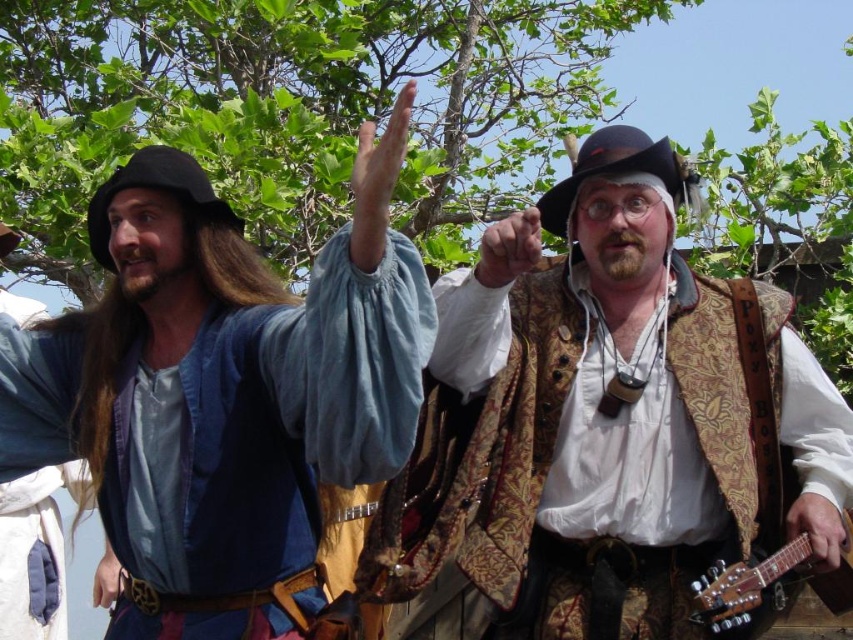
Question: Is gold-patterned vest at center smaller than wooden acoustic guitar at right?

Choices:
 (A) yes
 (B) no

Answer: (B)

Question: Which point appears closest to the camera in this image?

Choices:
 (A) (525, 266)
 (B) (809, 516)

Answer: (B)

Question: Observing the image, what is the correct spatial positioning of matte brown cowboy hat at center in reference to smooth leather glove at center?

Choices:
 (A) above
 (B) below

Answer: (A)

Question: Which of the following is the closest to the observer?

Choices:
 (A) (793, 518)
 (B) (12, 628)
 (C) (695, 173)
 (D) (120, 568)

Answer: (A)

Question: Can you confirm if white cotton shirt at left is positioned above wooden acoustic guitar at right?

Choices:
 (A) no
 (B) yes

Answer: (B)

Question: Which object is farther from the camera taking this photo?

Choices:
 (A) gold metallic ring at lower left
 (B) wooden acoustic guitar at right
 (C) smooth leather glove at center
 (D) black felt cowboy hat at left

Answer: (A)